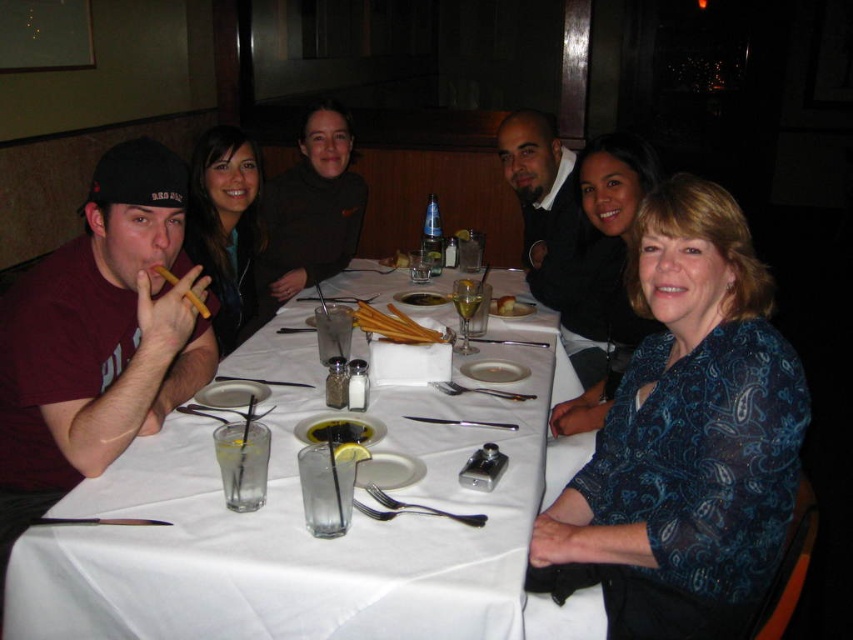
Is golden crispy breadsticks at center closer to camera compared to green leafy salad at center?

No, it is not.

What are the coordinates of `golden crispy breadsticks at center` in the screenshot? It's located at (393, 324).

You are a GUI agent. You are given a task and a screenshot of the screen. Output one action in this format:
    pyautogui.click(x=<x>, y=<y>)
    Task: Click on the smooth brown breadsticks at center
    
    Given the screenshot: What is the action you would take?
    pyautogui.click(x=421, y=298)

Which is in front, point (422, 294) or point (360, 460)?

Point (360, 460) is more forward.

Is point (403, 298) in front of point (341, 460)?

No, it is not.

The image size is (853, 640). I want to click on smooth brown breadsticks at center, so click(421, 298).

This screenshot has width=853, height=640. What do you see at coordinates (303, 524) in the screenshot?
I see `white cloth table at lower left` at bounding box center [303, 524].

Is white cloth table at lower left behind yellow lemon slice at center?

No.

Who is more forward, (514, 470) or (358, 448)?

Point (358, 448)

Where is `white cloth table at lower left`? This screenshot has height=640, width=853. white cloth table at lower left is located at coordinates point(303,524).